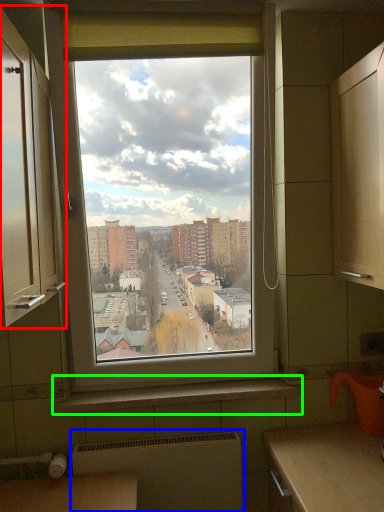
Question: Considering the real-world distances, which object is closest to cabinetry (highlighted by a red box)? radiator (highlighted by a blue box) or window sill (highlighted by a green box).

Choices:
 (A) radiator
 (B) window sill

Answer: (B)